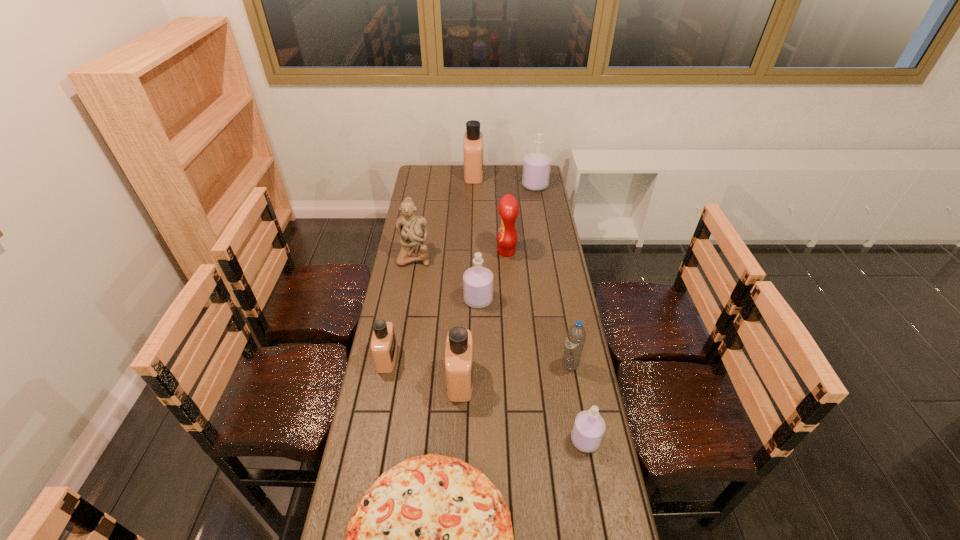
The height and width of the screenshot is (540, 960). I want to click on the leftmost beige perfume, so click(x=383, y=343).

This screenshot has height=540, width=960. I want to click on the smallest beige perfume, so click(383, 343).

Where is `vacant space located on the front label of the farthest beige perfume`? The image size is (960, 540). vacant space located on the front label of the farthest beige perfume is located at coordinates click(537, 174).

I want to click on free spot located 0.050m on the front of the biggest purple perfume, so click(538, 198).

Where is `free region located on the front-facing side of the white figurine`? The image size is (960, 540). free region located on the front-facing side of the white figurine is located at coordinates (409, 287).

You are a GUI agent. You are given a task and a screenshot of the screen. Output one action in this format:
    pyautogui.click(x=<x>, y=<y>)
    Task: Click on the vacant space located on the label side of the red condiment
    Image resolution: width=960 pixels, height=540 pixels.
    Given the screenshot: What is the action you would take?
    pyautogui.click(x=426, y=252)

Where is `vacant region located on the label side of the red condiment`? This screenshot has height=540, width=960. vacant region located on the label side of the red condiment is located at coordinates (444, 252).

In order to click on free region located 0.220m on the label side of the red condiment in this screenshot , I will do `click(448, 252)`.

This screenshot has width=960, height=540. In order to click on vacant space located on the front of the fifth farthest object in this screenshot , I will do `click(478, 387)`.

Locate an element on the screen. vacant space situated on the front label of the second smallest beige perfume is located at coordinates (543, 380).